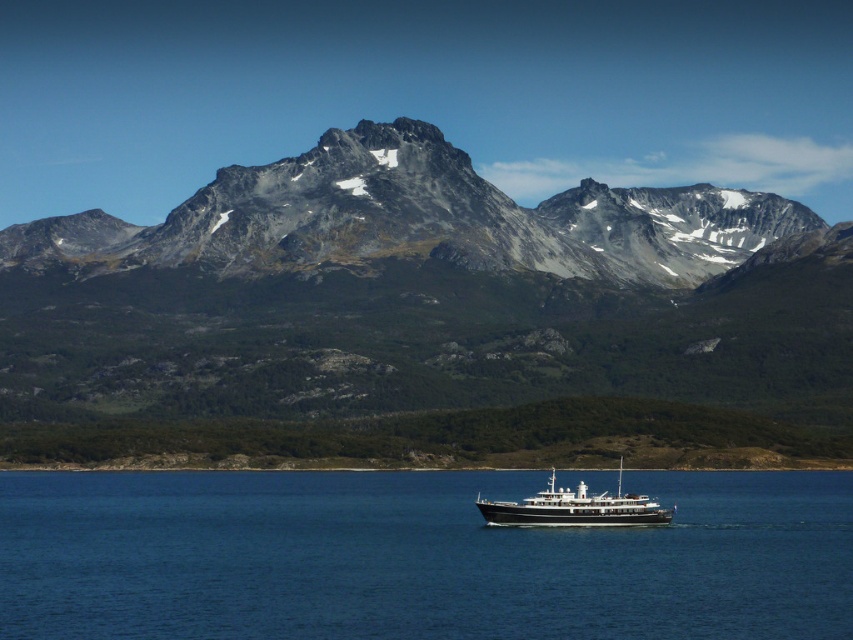
You are standing on the shore of the blue water at center and want to hike to the gray rocky mountain range at center. Which direction should you head to reach the mountains from your current position?

You should head to the left side of blue water at center to reach the gray rocky mountain range at center since it is positioned on the left side of blue water at center according to the description.

You are a photographer planning to capture the entire gray rocky mountain range at center and the black polished wood boat at center in a single frame. Given that your camera has a limited field of view, which object should you focus on to ensure both are visible without cropping?

Since the gray rocky mountain range at center is larger in size than the black polished wood boat at center, you should focus on the gray rocky mountain range at center to ensure both objects fit within the frame.